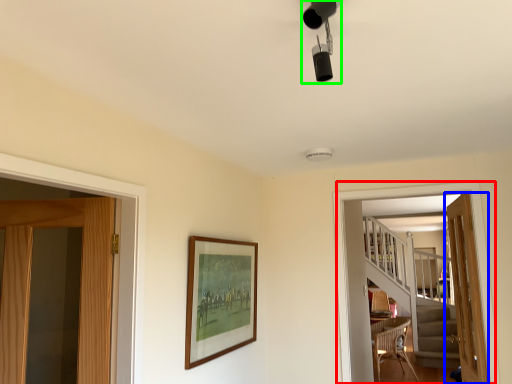
Question: Which is nearer to the screen door (highlighted by a red box)? door (highlighted by a blue box) or light fixture (highlighted by a green box).

Choices:
 (A) door
 (B) light fixture

Answer: (A)